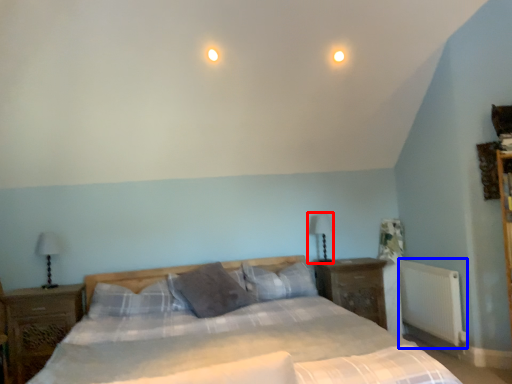
Question: Which object is further to the camera taking this photo, table lamp (highlighted by a red box) or radiator (highlighted by a blue box)?

Choices:
 (A) table lamp
 (B) radiator

Answer: (A)